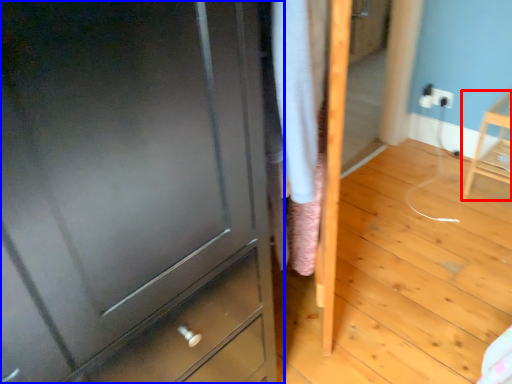
Question: Among these objects, which one is farthest to the camera, furniture (highlighted by a red box) or chest of drawers (highlighted by a blue box)?

Choices:
 (A) furniture
 (B) chest of drawers

Answer: (A)